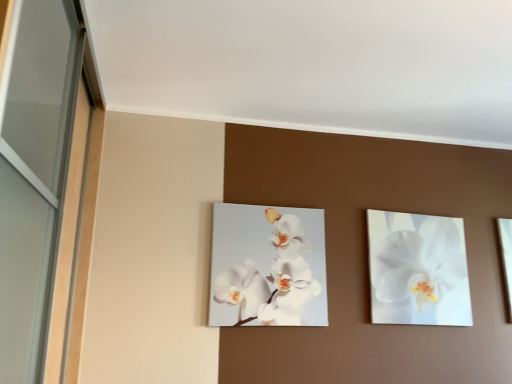
Question: Which direction should I rotate to look at white glossy orchid at center, acting as the 2th flower starting from the right, — up or down?

Choices:
 (A) up
 (B) down

Answer: (B)

Question: Is the position of white glossy orchid at upper right, the second flower in the left-to-right sequence, less distant than that of white glossy orchid at center, acting as the 2th flower starting from the right?

Choices:
 (A) no
 (B) yes

Answer: (A)

Question: Is white glossy orchid at upper right, positioned as the first flower in right-to-left order, to the right of white glossy orchid at center, acting as the 2th flower starting from the right, from the viewer's perspective?

Choices:
 (A) no
 (B) yes

Answer: (B)

Question: Considering the relative sizes of white glossy orchid at upper right, positioned as the first flower in right-to-left order, and white glossy orchid at center, which is counted as the first flower, starting from the left, in the image provided, is white glossy orchid at upper right, positioned as the first flower in right-to-left order, smaller than white glossy orchid at center, which is counted as the first flower, starting from the left,?

Choices:
 (A) no
 (B) yes

Answer: (A)

Question: From the image's perspective, is white glossy orchid at upper right, positioned as the first flower in right-to-left order, beneath white glossy orchid at center, which is counted as the first flower, starting from the left?

Choices:
 (A) yes
 (B) no

Answer: (A)

Question: Is there a large distance between white glossy orchid at upper right, positioned as the first flower in right-to-left order, and white glossy orchid at center, acting as the 2th flower starting from the right?

Choices:
 (A) yes
 (B) no

Answer: (B)

Question: Is white glossy orchid at upper right, the second flower in the left-to-right sequence, to the left of white glossy orchid at center, acting as the 2th flower starting from the right, from the viewer's perspective?

Choices:
 (A) no
 (B) yes

Answer: (A)

Question: Is white glossy orchid at center, which is counted as the first flower, starting from the left, closer to the viewer compared to white glossy orchid at upper right, positioned as the first flower in right-to-left order?

Choices:
 (A) no
 (B) yes

Answer: (B)

Question: From the image's perspective, is white glossy orchid at center, acting as the 2th flower starting from the right, under white glossy orchid at upper right, the second flower in the left-to-right sequence?

Choices:
 (A) no
 (B) yes

Answer: (A)

Question: From a real-world perspective, is white glossy orchid at center, which is counted as the first flower, starting from the left, physically above white glossy orchid at upper right, the second flower in the left-to-right sequence?

Choices:
 (A) no
 (B) yes

Answer: (A)

Question: Considering the relative sizes of white glossy orchid at center, which is counted as the first flower, starting from the left, and white glossy orchid at upper right, the second flower in the left-to-right sequence, in the image provided, is white glossy orchid at center, which is counted as the first flower, starting from the left, thinner than white glossy orchid at upper right, the second flower in the left-to-right sequence,?

Choices:
 (A) yes
 (B) no

Answer: (A)

Question: Is white glossy orchid at center, acting as the 2th flower starting from the right, with white glossy orchid at upper right, the second flower in the left-to-right sequence?

Choices:
 (A) no
 (B) yes

Answer: (A)

Question: From the image's perspective, is white glossy orchid at center, acting as the 2th flower starting from the right, on white glossy orchid at upper right, positioned as the first flower in right-to-left order?

Choices:
 (A) no
 (B) yes

Answer: (B)

Question: From a real-world perspective, is white glossy orchid at upper right, positioned as the first flower in right-to-left order, above or below white glossy orchid at center, which is counted as the first flower, starting from the left?

Choices:
 (A) above
 (B) below

Answer: (A)